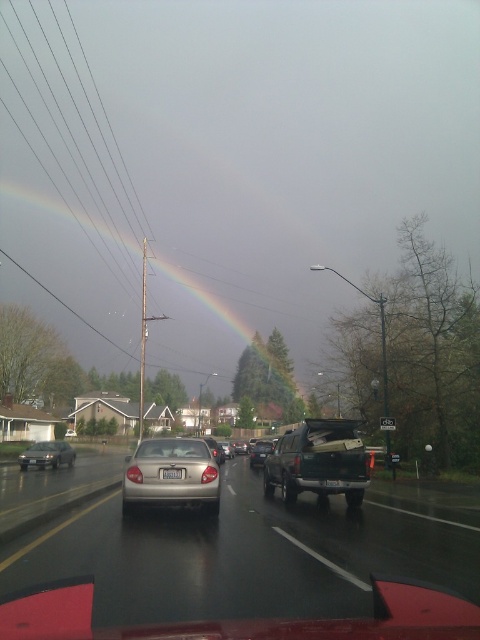
Question: Can you confirm if shiny silver sedan at center is smaller than satin black sedan at center?

Choices:
 (A) no
 (B) yes

Answer: (B)

Question: Among these objects, which one is farthest from the camera?

Choices:
 (A) shiny silver sedan at center
 (B) satin black sedan at center
 (C) black plastic license plate at center
 (D) rainbow at upper center

Answer: (D)

Question: Is gold matte sedan at center above black plastic license plate at center?

Choices:
 (A) no
 (B) yes

Answer: (A)

Question: Is green matte truck at center above satin silver sedan at center?

Choices:
 (A) yes
 (B) no

Answer: (A)

Question: Which of these objects is positioned closest to the satin black sedan at center?

Choices:
 (A) shiny silver sedan at center
 (B) metallic silver sedan at center
 (C) green matte truck at center
 (D) gold matte sedan at center

Answer: (B)

Question: Estimate the real-world distances between objects in this image. Which object is closer to the satin silver sedan at center?

Choices:
 (A) matte black sedan at left
 (B) gold matte sedan at center
 (C) metallic silver sedan at center
 (D) satin black sedan at center

Answer: (D)